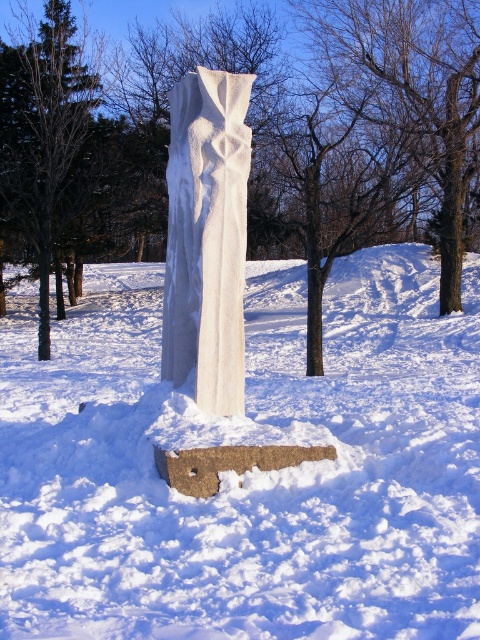
Question: Is white textured stone at center to the left of white stone column at center from the viewer's perspective?

Choices:
 (A) no
 (B) yes

Answer: (A)

Question: Which of these objects is positioned closest to the dark green bark tree at center?

Choices:
 (A) white stone column at center
 (B) white textured stone at center
 (C) white marble column at center
 (D) brown bark tree at center

Answer: (A)

Question: Which of these objects is positioned farthest from the brown bark tree at center?

Choices:
 (A) white textured stone at center
 (B) dark green bark tree at center
 (C) white marble column at center

Answer: (C)

Question: Which point appears farthest from the camera in this image?

Choices:
 (A) (386, 483)
 (B) (462, 68)
 (C) (165, 289)

Answer: (B)

Question: Does white textured stone at center lie in front of dark green bark tree at center?

Choices:
 (A) no
 (B) yes

Answer: (B)

Question: Does white stone column at center have a greater width compared to brown bark tree at center?

Choices:
 (A) no
 (B) yes

Answer: (B)